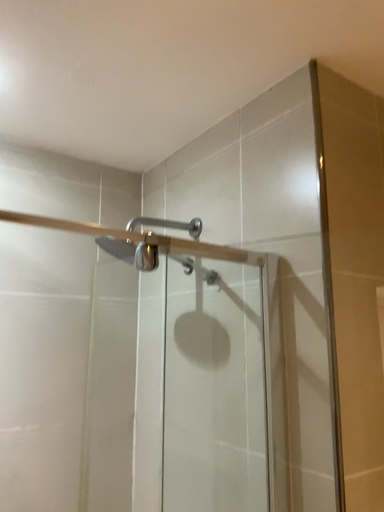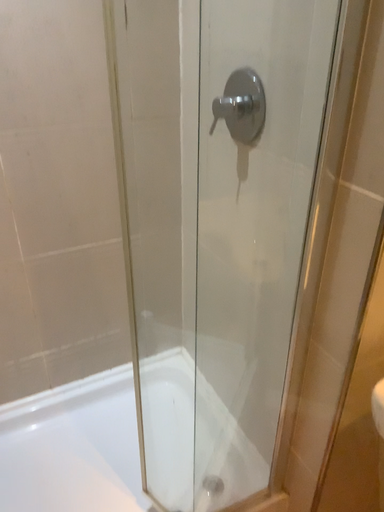
Question: How did the camera likely rotate when shooting the video?

Choices:
 (A) rotated left
 (B) rotated right

Answer: (A)